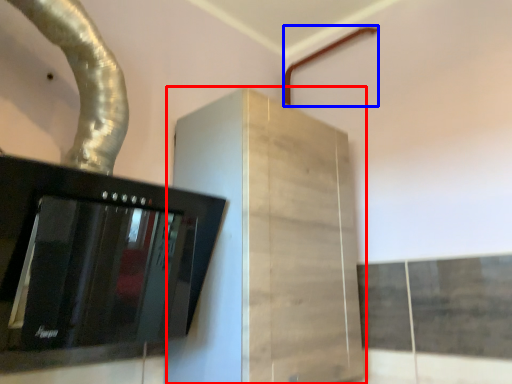
Question: Among these objects, which one is nearest to the camera, cabinetry (highlighted by a red box) or pipe (highlighted by a blue box)?

Choices:
 (A) cabinetry
 (B) pipe

Answer: (A)